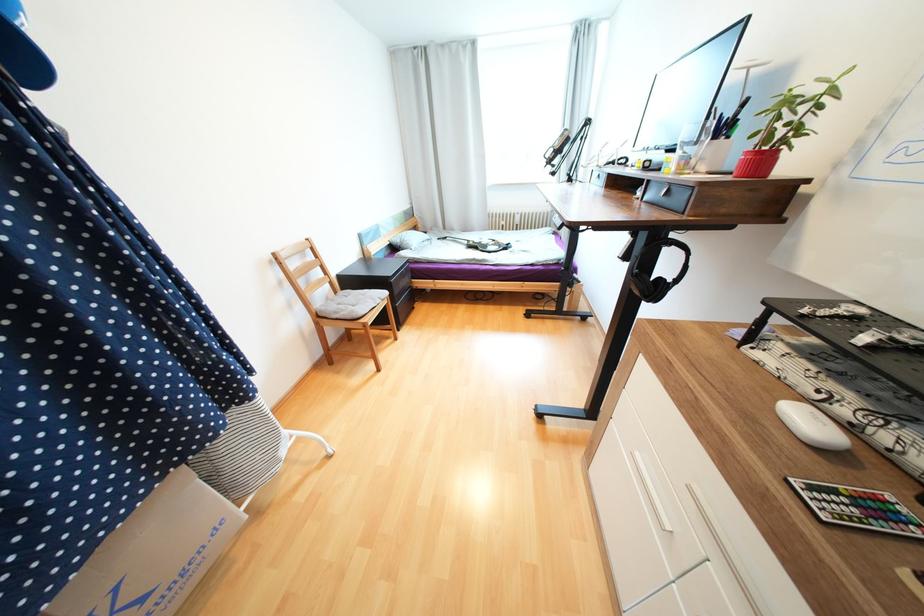
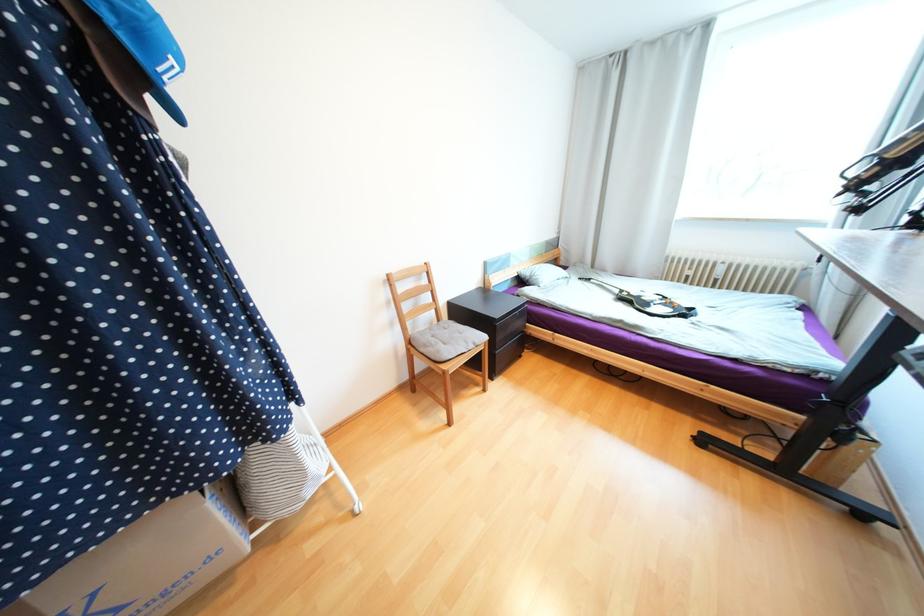
The point at [137,511] is marked in the first image. Where is the corresponding point in the second image?

(116, 535)